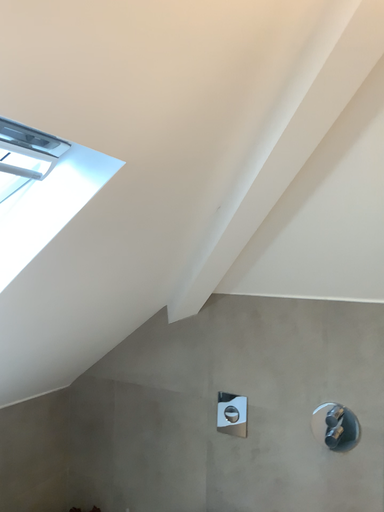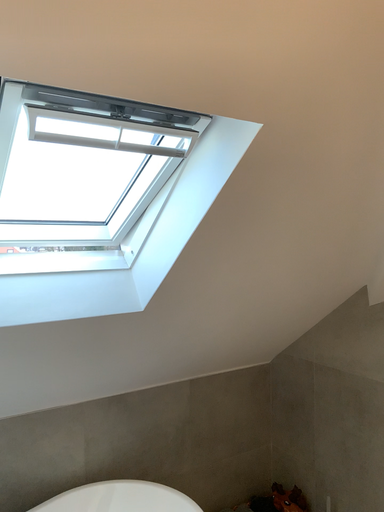
Question: Which way did the camera rotate in the video?

Choices:
 (A) rotated left
 (B) rotated right

Answer: (A)